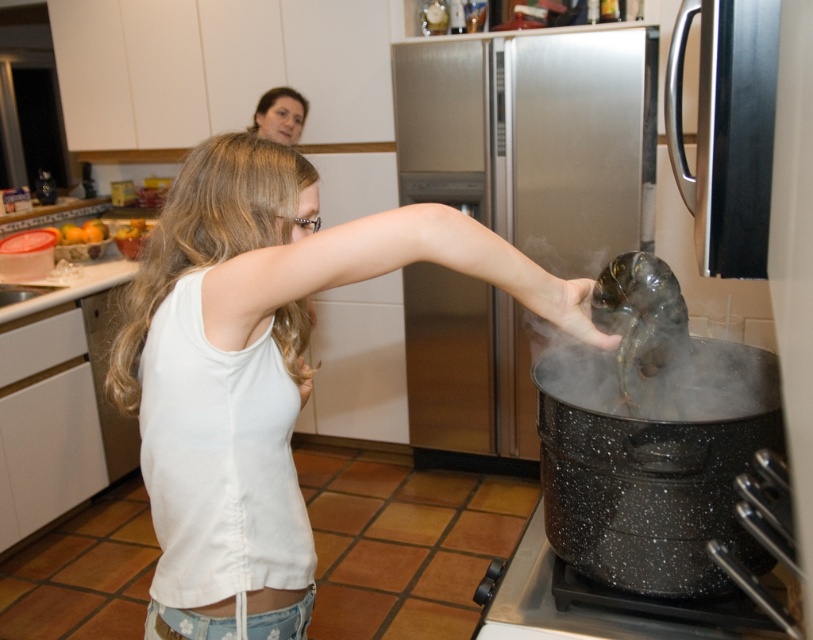
Question: Can you confirm if white vapor at pot right is bigger than matte skin at upper center?

Choices:
 (A) yes
 (B) no

Answer: (A)

Question: Is shiny metallic fish at center smaller than matte skin at upper center?

Choices:
 (A) no
 (B) yes

Answer: (B)

Question: Which point appears closest to the camera in this image?

Choices:
 (A) (538, 595)
 (B) (618, 323)

Answer: (B)

Question: Considering the relative positions of white cotton tank top at center and shiny metallic fish at center in the image provided, where is white cotton tank top at center located with respect to shiny metallic fish at center?

Choices:
 (A) below
 (B) above

Answer: (A)

Question: Which object appears farthest from the camera in this image?

Choices:
 (A) stainless steel refrigerator at center
 (B) shiny metallic fish at center
 (C) black speckled pot at lower right
 (D) white cotton tank top at center

Answer: (A)

Question: Which of the following is the closest to the observer?

Choices:
 (A) satin black refrigerator at right
 (B) stainless steel refrigerator at center
 (C) white cotton tank top at center

Answer: (A)